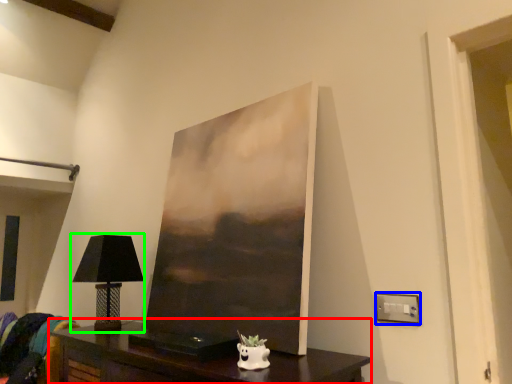
Question: Estimate the real-world distances between objects in this image. Which object is farther from table (highlighted by a red box), electric outlet (highlighted by a blue box) or table lamp (highlighted by a green box)?

Choices:
 (A) electric outlet
 (B) table lamp

Answer: (A)